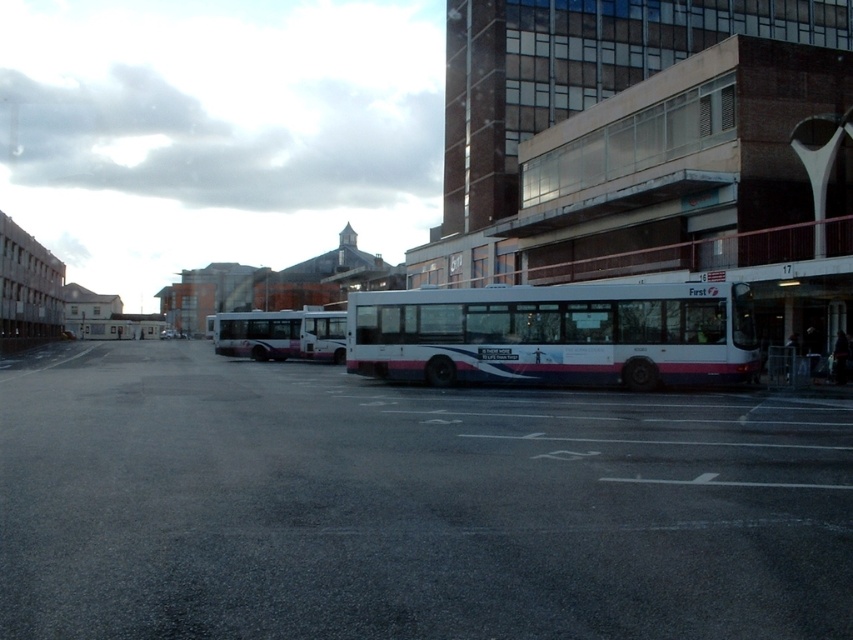
Can you confirm if gray asphalt parking lot at center is bigger than white matte bus at center?

No, gray asphalt parking lot at center is not bigger than white matte bus at center.

Is the position of gray asphalt parking lot at center more distant than that of white matte bus at center?

That is False.

Locate an element on the screen. Image resolution: width=853 pixels, height=640 pixels. gray asphalt parking lot at center is located at coordinates (407, 506).

Can you confirm if white matte bus at center is positioned below white glossy bus at center?

Indeed, white matte bus at center is positioned under white glossy bus at center.

Describe the element at coordinates (556, 333) in the screenshot. The height and width of the screenshot is (640, 853). I see `white matte bus at center` at that location.

The height and width of the screenshot is (640, 853). In order to click on white matte bus at center in this screenshot , I will do `click(556, 333)`.

Does gray asphalt parking lot at center lie behind white glossy bus at center?

No, gray asphalt parking lot at center is closer to the viewer.

Is gray asphalt parking lot at center closer to the viewer compared to white glossy bus at center?

That is True.

Does point (280, 614) come in front of point (268, 349)?

Yes, it is in front of point (268, 349).

At what (x,y) coordinates should I click in order to perform the action: click on gray asphalt parking lot at center. Please return your answer as a coordinate pair (x, y). Image resolution: width=853 pixels, height=640 pixels. Looking at the image, I should click on (407, 506).